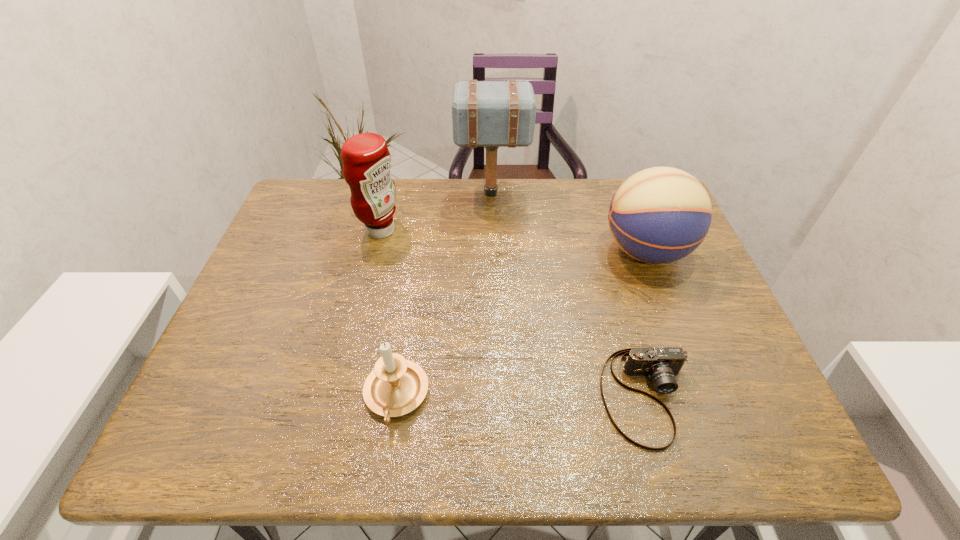
The image size is (960, 540). Identify the location of free point between the third object from left to right and the basketball. (568, 222).

Find the location of `blank region between the farthest object and the condiment`. blank region between the farthest object and the condiment is located at coordinates (x=436, y=212).

What are the coordinates of `vacant area that lies between the candle holder and the basketball` in the screenshot? It's located at (520, 324).

The width and height of the screenshot is (960, 540). Identify the location of free space between the condiment and the basketball. (513, 241).

The width and height of the screenshot is (960, 540). I want to click on free space between the camera and the basketball, so click(x=646, y=323).

The height and width of the screenshot is (540, 960). Identify the location of free space between the candle holder and the condiment. (389, 313).

Where is `empty space between the second shortest object and the camera`? The height and width of the screenshot is (540, 960). empty space between the second shortest object and the camera is located at coordinates (521, 396).

Locate which object is the closest to the condiment. Please provide its 2D coordinates. Your answer should be formatted as a tuple, i.e. [(x, y)], where the tuple contains the x and y coordinates of a point satisfying the conditions above.

[(491, 114)]

In order to click on object that is the third closest one to the third object from right to left in this screenshot , I will do `click(661, 365)`.

Identify the location of free space that satisfies the following two spatial constraints: 1. on the patterned surface of the basketball; 2. on the front-facing side of the camera. The height and width of the screenshot is (540, 960). (701, 396).